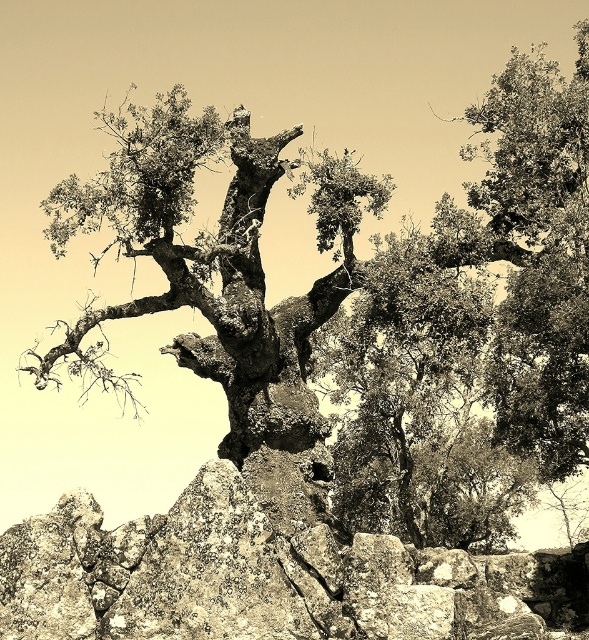
Question: In this image, where is rough textured rock at lower left located relative to rough bark tree trunk at center?

Choices:
 (A) right
 (B) left

Answer: (A)

Question: Which point is closer to the camera taking this photo?

Choices:
 (A) (449, 561)
 (B) (279, 332)

Answer: (A)

Question: Is rough textured rock at lower left further to camera compared to rough bark tree trunk at center?

Choices:
 (A) no
 (B) yes

Answer: (A)

Question: Does rough textured rock at lower left have a larger size compared to rough bark tree trunk at center?

Choices:
 (A) no
 (B) yes

Answer: (A)

Question: Which point is closer to the camera?

Choices:
 (A) rough bark tree trunk at center
 (B) rough textured rock at lower left

Answer: (B)

Question: Among these points, which one is nearest to the camera?

Choices:
 (A) (161, 150)
 (B) (389, 586)

Answer: (B)